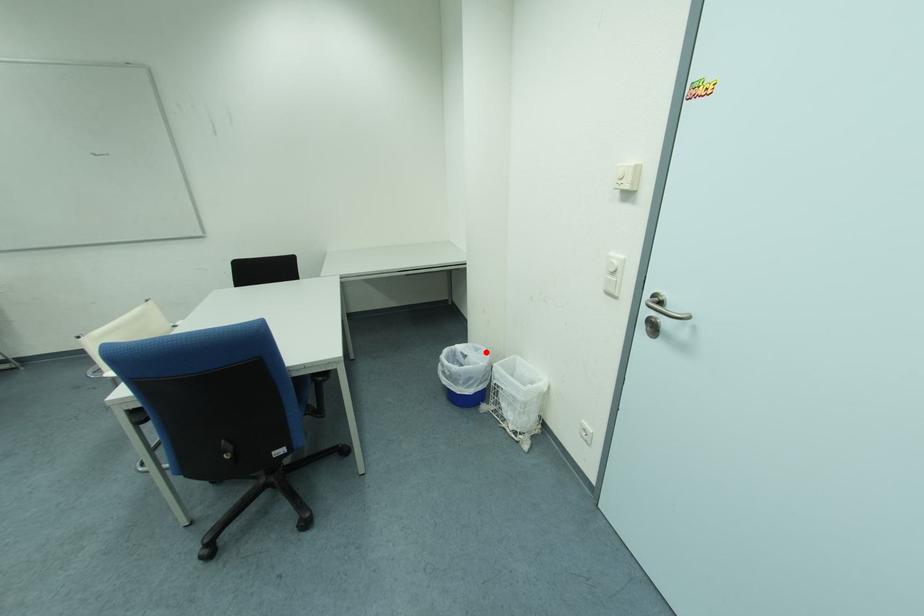
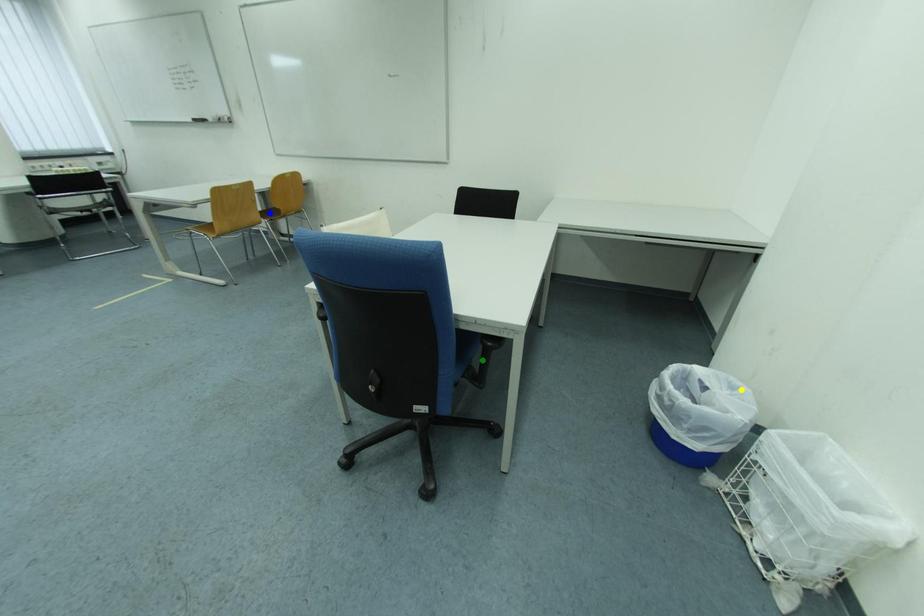
Question: I am providing you with two images of the same scene from different viewpoints. A red point is marked on the first image. You are given multiple points on the second image. Which point in image 2 is actually the same real-world point as the red point in image 1?

Choices:
 (A) blue point
 (B) green point
 (C) yellow point

Answer: (C)